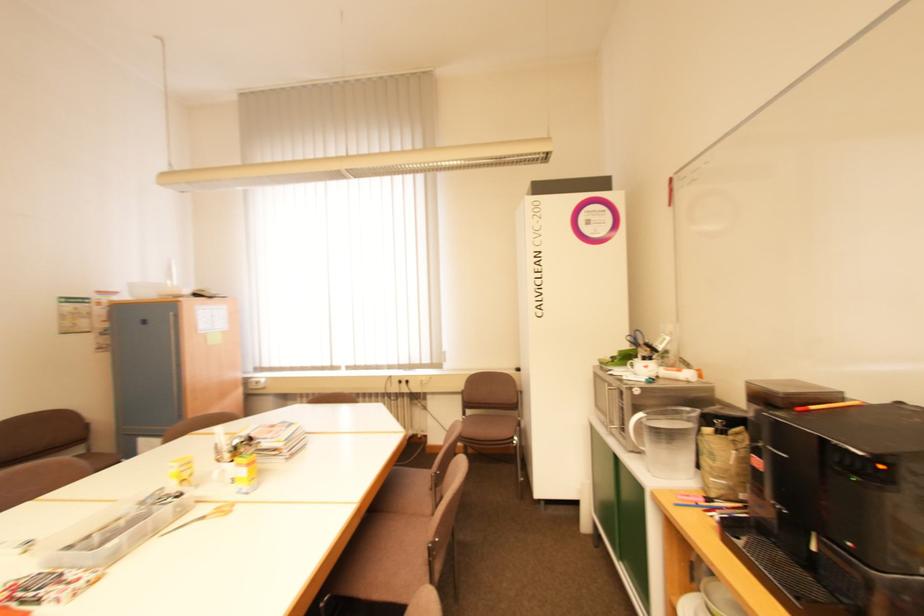
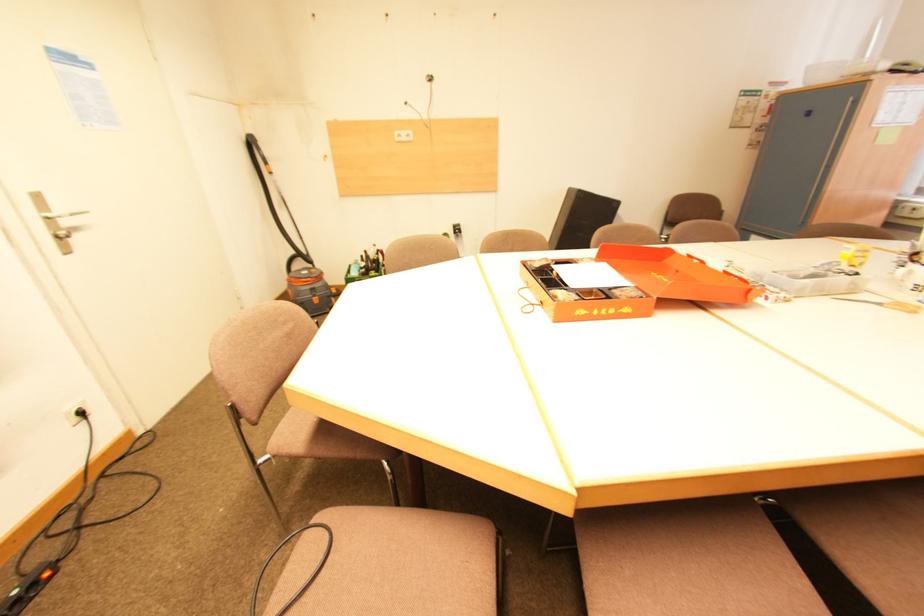
From the picture: Based on the continuous images, in which direction is the camera rotating?

The camera's rotation is toward left-down.